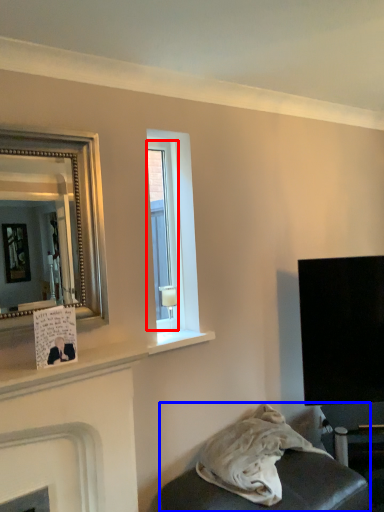
Question: Which of the following is the closest to the observer, window (highlighted by a red box) or furniture (highlighted by a blue box)?

Choices:
 (A) window
 (B) furniture

Answer: (B)